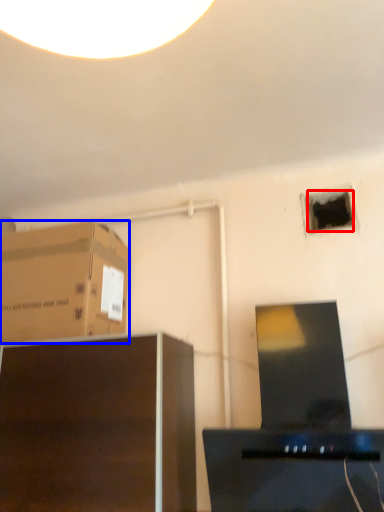
Question: Among these objects, which one is farthest to the camera, hole (highlighted by a red box) or cardboard box (highlighted by a blue box)?

Choices:
 (A) hole
 (B) cardboard box

Answer: (A)